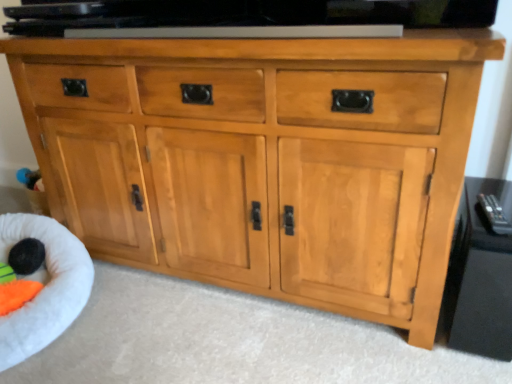
Question: Is glossy black tv stand at right facing away from black fuzzy ball at lower left?

Choices:
 (A) yes
 (B) no

Answer: (B)

Question: Considering the relative sizes of glossy black tv stand at right and black fuzzy ball at lower left in the image provided, is glossy black tv stand at right wider than black fuzzy ball at lower left?

Choices:
 (A) no
 (B) yes

Answer: (B)

Question: Does glossy black tv stand at right come behind black fuzzy ball at lower left?

Choices:
 (A) no
 (B) yes

Answer: (A)

Question: Is glossy black tv stand at right closer to the viewer compared to black fuzzy ball at lower left?

Choices:
 (A) no
 (B) yes

Answer: (B)

Question: Does glossy black tv stand at right have a smaller size compared to black fuzzy ball at lower left?

Choices:
 (A) no
 (B) yes

Answer: (A)

Question: From a real-world perspective, is black fuzzy ball at lower left positioned above or below glossy black tv stand at right?

Choices:
 (A) below
 (B) above

Answer: (A)

Question: Is black fuzzy ball at lower left taller or shorter than glossy black tv stand at right?

Choices:
 (A) tall
 (B) short

Answer: (B)

Question: Considering the positions of black fuzzy ball at lower left and glossy black tv stand at right in the image, is black fuzzy ball at lower left bigger or smaller than glossy black tv stand at right?

Choices:
 (A) small
 (B) big

Answer: (A)

Question: In the image, is black fuzzy ball at lower left on the left side or the right side of glossy black tv stand at right?

Choices:
 (A) left
 (B) right

Answer: (A)

Question: Considering the positions of glossy black tv stand at right and white plush infant bed at lower left in the image, is glossy black tv stand at right wider or thinner than white plush infant bed at lower left?

Choices:
 (A) wide
 (B) thin

Answer: (B)

Question: From a real-world perspective, is glossy black tv stand at right above or below white plush infant bed at lower left?

Choices:
 (A) above
 (B) below

Answer: (A)

Question: Is glossy black tv stand at right inside the boundaries of white plush infant bed at lower left, or outside?

Choices:
 (A) inside
 (B) outside

Answer: (B)

Question: Is point (490, 319) positioned closer to the camera than point (10, 336)?

Choices:
 (A) farther
 (B) closer

Answer: (A)

Question: In the image, is black fuzzy ball at lower left on the left side or the right side of white plush infant bed at lower left?

Choices:
 (A) left
 (B) right

Answer: (B)

Question: From a real-world perspective, is black fuzzy ball at lower left physically located above or below white plush infant bed at lower left?

Choices:
 (A) above
 (B) below

Answer: (A)